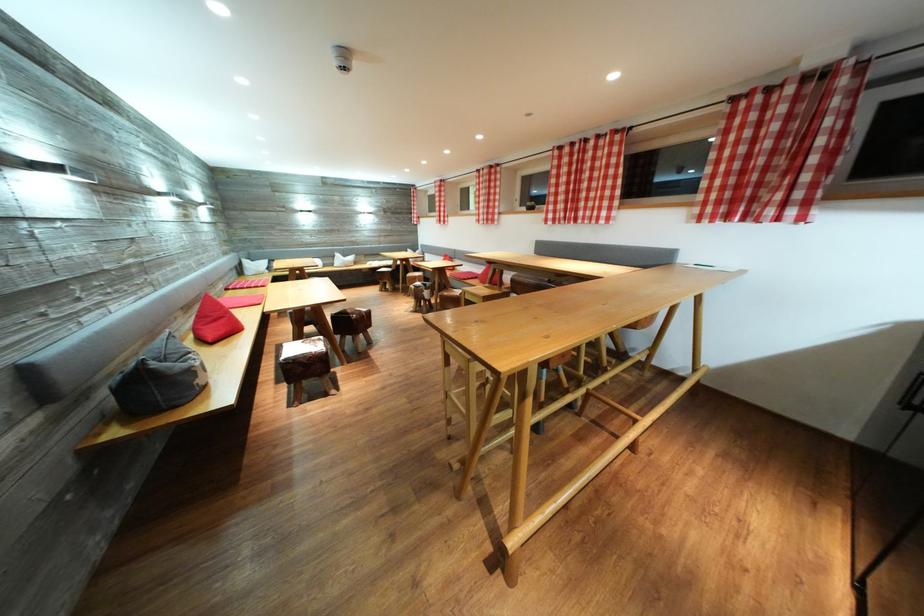
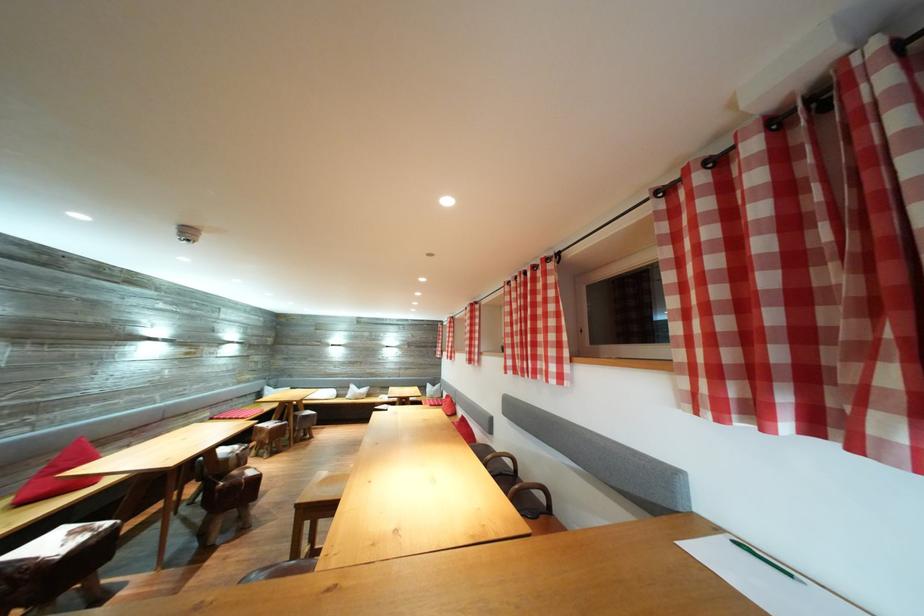
Where in the second image is the point corresponding to (494,219) from the first image?

(477, 359)